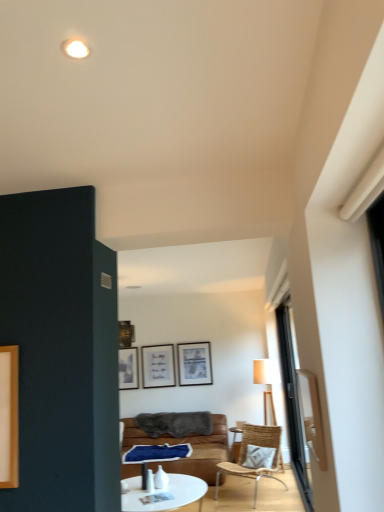
Question: Considering the relative positions of transparent glass door at right and woven wood chair at center in the image provided, is transparent glass door at right to the left of woven wood chair at center from the viewer's perspective?

Choices:
 (A) yes
 (B) no

Answer: (B)

Question: Is transparent glass door at right turned away from woven wood chair at center?

Choices:
 (A) yes
 (B) no

Answer: (B)

Question: From the image's perspective, is transparent glass door at right below woven wood chair at center?

Choices:
 (A) yes
 (B) no

Answer: (B)

Question: Considering the relative positions of transparent glass door at right and woven wood chair at center in the image provided, is transparent glass door at right to the right of woven wood chair at center from the viewer's perspective?

Choices:
 (A) yes
 (B) no

Answer: (A)

Question: Is transparent glass door at right not close to woven wood chair at center?

Choices:
 (A) no
 (B) yes

Answer: (B)

Question: Based on their sizes in the image, would you say matte black picture frame at upper center is bigger or smaller than woven wood chair at center?

Choices:
 (A) small
 (B) big

Answer: (A)

Question: In terms of width, does matte black picture frame at upper center look wider or thinner when compared to woven wood chair at center?

Choices:
 (A) wide
 (B) thin

Answer: (B)

Question: Considering the relative positions of matte black picture frame at upper center and woven wood chair at center in the image provided, is matte black picture frame at upper center to the left or to the right of woven wood chair at center?

Choices:
 (A) right
 (B) left

Answer: (B)

Question: Considering the positions of matte black picture frame at upper center and woven wood chair at center in the image, is matte black picture frame at upper center taller or shorter than woven wood chair at center?

Choices:
 (A) short
 (B) tall

Answer: (A)

Question: Based on their sizes in the image, would you say white textured pillow at lower right is bigger or smaller than transparent glass door at right?

Choices:
 (A) small
 (B) big

Answer: (B)

Question: Is white textured pillow at lower right in front of or behind transparent glass door at right in the image?

Choices:
 (A) behind
 (B) front

Answer: (A)

Question: From the image's perspective, is white textured pillow at lower right located above or below transparent glass door at right?

Choices:
 (A) above
 (B) below

Answer: (B)

Question: Based on their positions, is white textured pillow at lower right located to the left or right of transparent glass door at right?

Choices:
 (A) right
 (B) left

Answer: (A)

Question: Considering the positions of white textured pillow at lower right and white glossy coffee table at center in the image, is white textured pillow at lower right taller or shorter than white glossy coffee table at center?

Choices:
 (A) short
 (B) tall

Answer: (A)

Question: Looking at the image, does white textured pillow at lower right seem bigger or smaller compared to white glossy coffee table at center?

Choices:
 (A) big
 (B) small

Answer: (B)